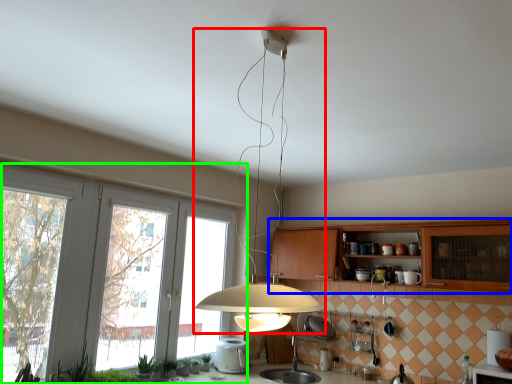
Question: Which object is the closest to the lamp (highlighted by a red box)? Choose among these: cabinetry (highlighted by a blue box) or window (highlighted by a green box).

Choices:
 (A) cabinetry
 (B) window

Answer: (A)